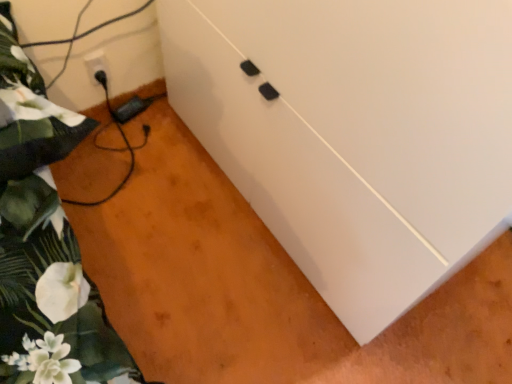
Question: Looking at their shapes, would you say white plastic electric outlet at lower left is wider or thinner than white matte cabinet at center?

Choices:
 (A) thin
 (B) wide

Answer: (A)

Question: Is point (88, 56) closer or farther from the camera than point (437, 31)?

Choices:
 (A) closer
 (B) farther

Answer: (B)

Question: Considering the real-world distances, which object is farthest from the white plastic electric outlet at lower left?

Choices:
 (A) green floral fabric at left
 (B) white matte cabinet at center

Answer: (B)

Question: Which object is positioned farthest from the white plastic electric outlet at lower left?

Choices:
 (A) green floral fabric at left
 (B) white matte cabinet at center

Answer: (B)